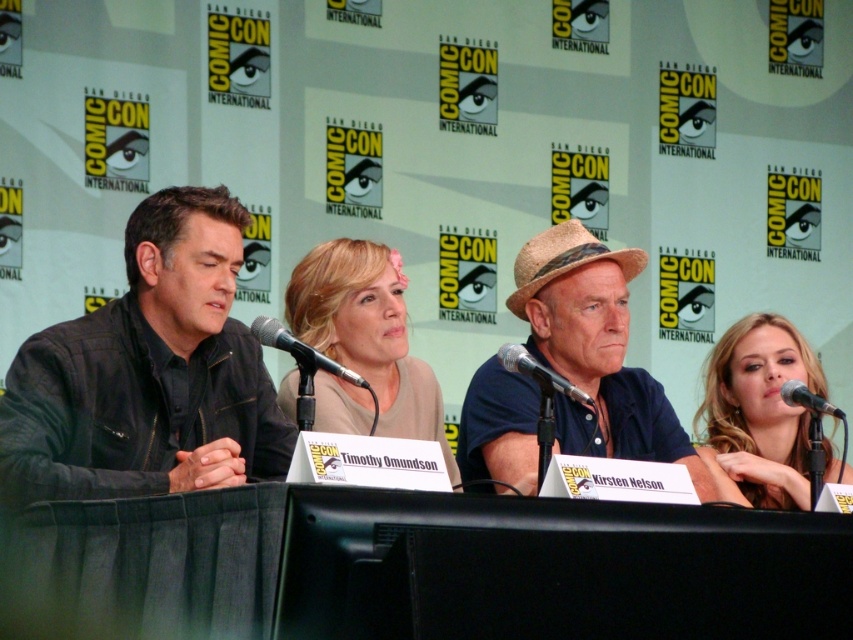
Based on the photo, you are attending a panel discussion at Comic Con and want to place a small notebook on the table. The notebook is 10 cm wide. Can you fit it between the black fabric table at center and the black metallic microphone at lower right?

The black fabric table at center is to the left of the black metallic microphone at lower right, so there is space between them. The notebook can be placed there as long as the distance between the two objects is sufficient. However, the exact distance isn

You are a photographer at Comic Con who needs to capture a closeup shot of the black metallic microphone at center. You have a camera with a 100mm lens. Considering the black fabric table at center is in the way, can you still get the shot without moving the table?

The black fabric table at center is larger in size than the black metallic microphone at center, so the table may block the direct line of sight to the microphone. You might need to adjust your angle or position to capture the microphone without obstruction.

You are an attendee at Comic Con and want to take a photo of the black fabric table at center and the black metallic microphone at center. Which object will appear larger in your photo?

The black fabric table at center will appear larger in the photo because it is closer to the viewer than the black metallic microphone at center.